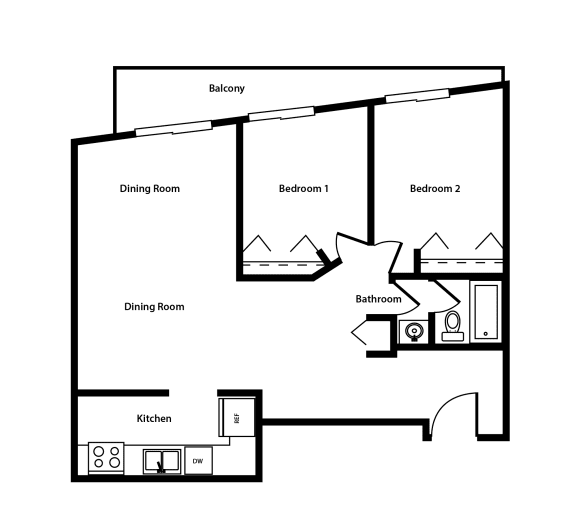
Where is `door`? The width and height of the screenshot is (576, 518). door is located at coordinates (457, 437).